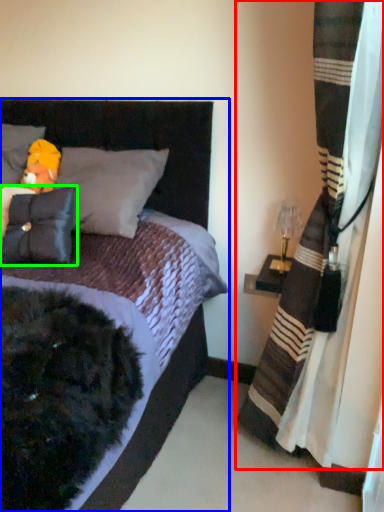
Question: Based on their relative distances, which object is farther from curtain (highlighted by a red box)? Choose from bed (highlighted by a blue box) and pillow (highlighted by a green box).

Choices:
 (A) bed
 (B) pillow

Answer: (B)